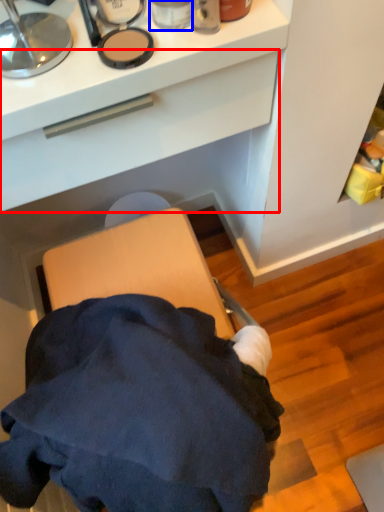
Question: Which object appears farthest to the camera in this image, drawer (highlighted by a red box) or toiletry (highlighted by a blue box)?

Choices:
 (A) drawer
 (B) toiletry

Answer: (B)